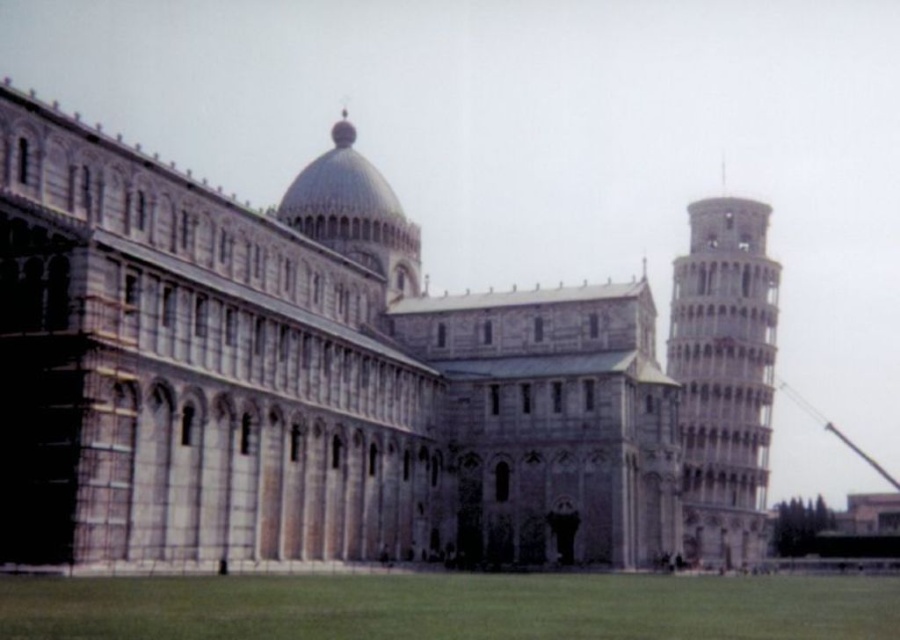
Can you confirm if stone cathedral at center is thinner than light gray stone tower at right?

No, stone cathedral at center is not thinner than light gray stone tower at right.

Looking at this image, does stone cathedral at center have a greater width compared to light gray stone tower at right?

Indeed, stone cathedral at center has a greater width compared to light gray stone tower at right.

Where is `stone cathedral at center`? Image resolution: width=900 pixels, height=640 pixels. stone cathedral at center is located at coordinates (353, 378).